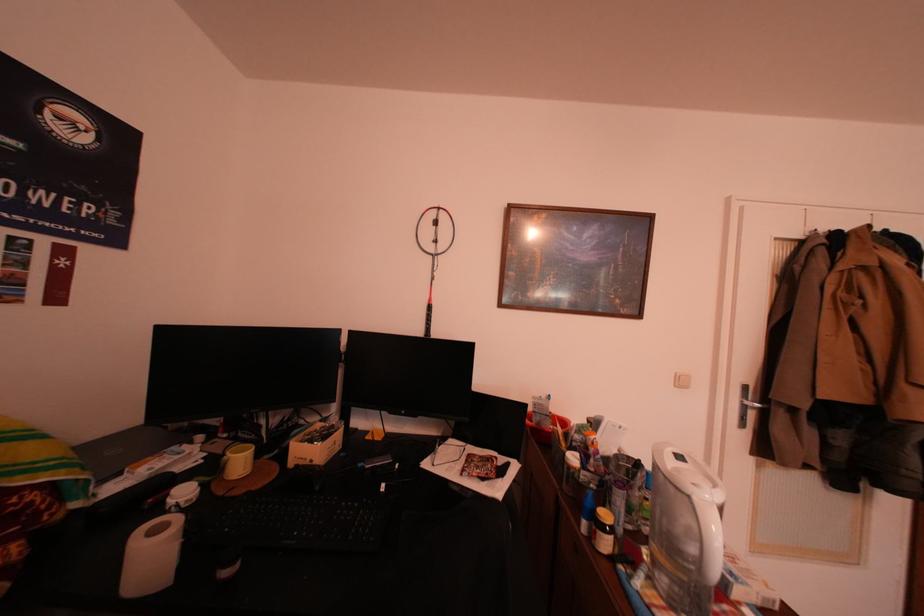
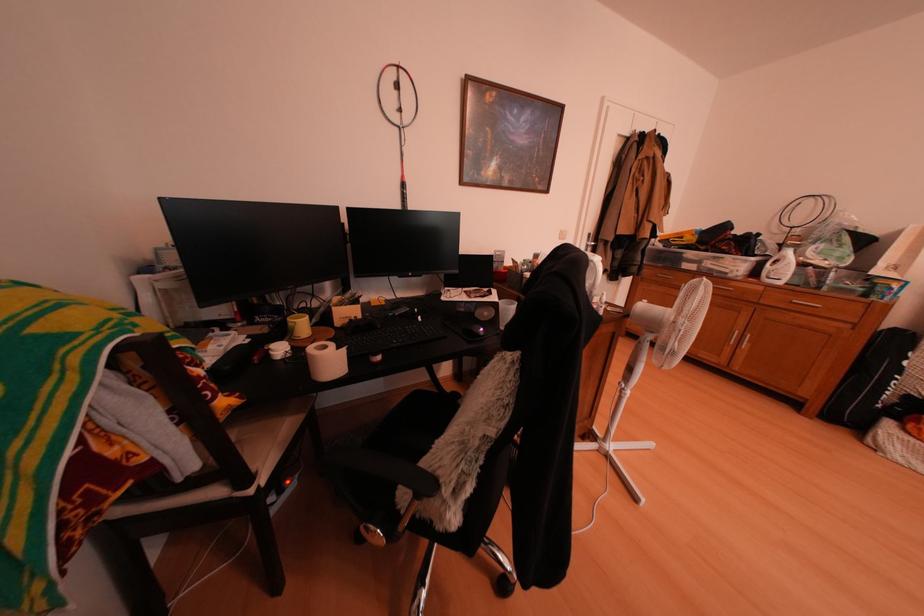
The first image is from the beginning of the video and the second image is from the end. How did the camera likely rotate when shooting the video?

The camera rotated toward right-down.